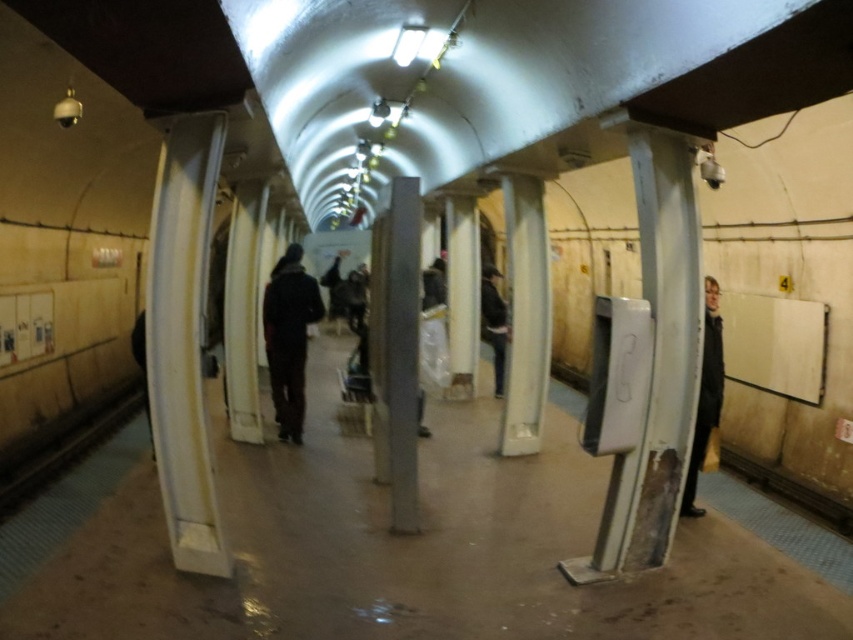
Who is positioned more to the left, dark gray fabric jacket at center or dark brown leather jacket at center?

From the viewer's perspective, dark gray fabric jacket at center appears more on the left side.

Is dark gray fabric jacket at center smaller than dark brown leather jacket at center?

Yes, dark gray fabric jacket at center is smaller than dark brown leather jacket at center.

Does point (292, 320) come in front of point (488, 275)?

Yes, point (292, 320) is in front of point (488, 275).

Locate an element on the screen. The height and width of the screenshot is (640, 853). dark gray fabric jacket at center is located at coordinates (288, 337).

Between black leather jacket at right and dark brown leather jacket at center, which one appears on the left side from the viewer's perspective?

dark brown leather jacket at center is more to the left.

Does black leather jacket at right have a smaller size compared to dark brown leather jacket at center?

Yes.

Which is behind, point (711, 285) or point (483, 336)?

The point (483, 336) is more distant.

The image size is (853, 640). In order to click on black leather jacket at right in this screenshot , I will do `click(705, 394)`.

Can you confirm if dark gray fabric jacket at center is taller than black leather jacket at right?

Indeed, dark gray fabric jacket at center has a greater height compared to black leather jacket at right.

Is dark gray fabric jacket at center thinner than black leather jacket at right?

No, dark gray fabric jacket at center is not thinner than black leather jacket at right.

Where is `dark gray fabric jacket at center`? The height and width of the screenshot is (640, 853). dark gray fabric jacket at center is located at coordinates (288, 337).